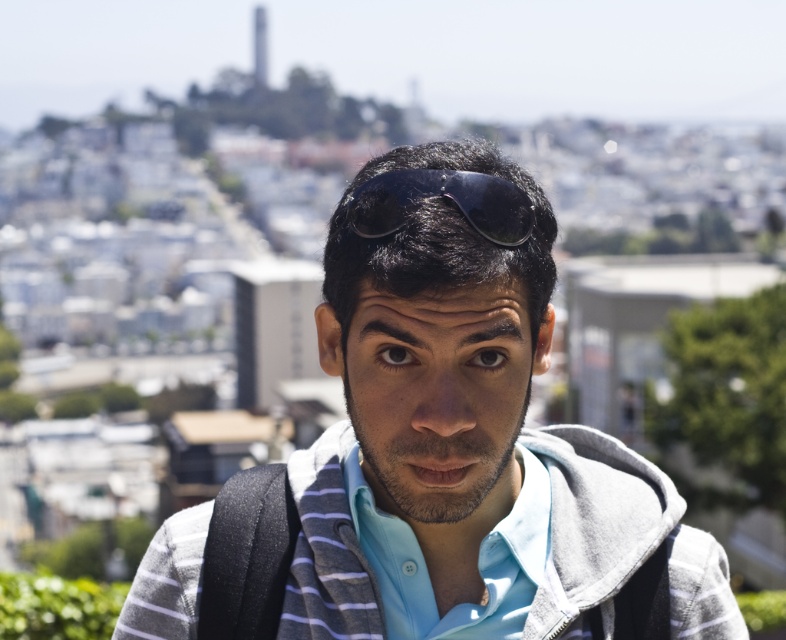
You are a fashion stylist trying to help a client decide between layering options. The client has a gray cotton hoodie at center and a gray fleece sweatshirt at center. Based on the image, which one should be worn on top to create a layered look?

The gray fleece sweatshirt at center should be worn on top because the gray cotton hoodie at center is positioned below it in the image, indicating it is underneath.

You are a photographer trying to capture the gray cotton hoodie at center in your shot. The camera you are using has a focus point at coordinate 0.673, 0.593. Will the focus point align with the hoodie?

The 2D location of gray cotton hoodie at center is at point (465, 429), so yes, the focus point will align with the hoodie.